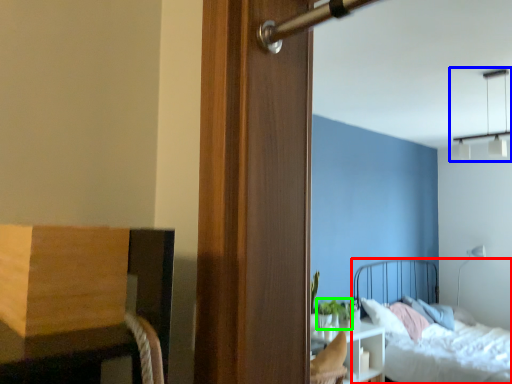
Question: Which is nearer to the bed (highlighted by a red box)? light fixture (highlighted by a blue box) or plant (highlighted by a green box).

Choices:
 (A) light fixture
 (B) plant

Answer: (B)